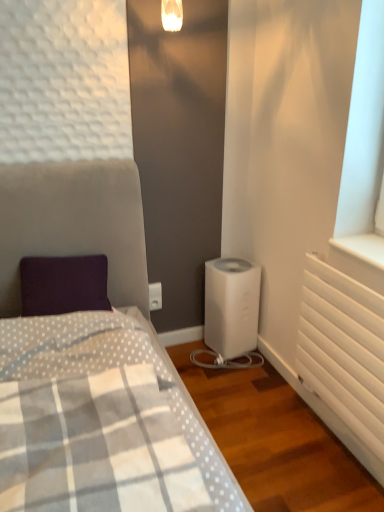
In order to click on vacant space in white matte radiator at right (from a real-world perspective) in this screenshot , I will do `click(341, 441)`.